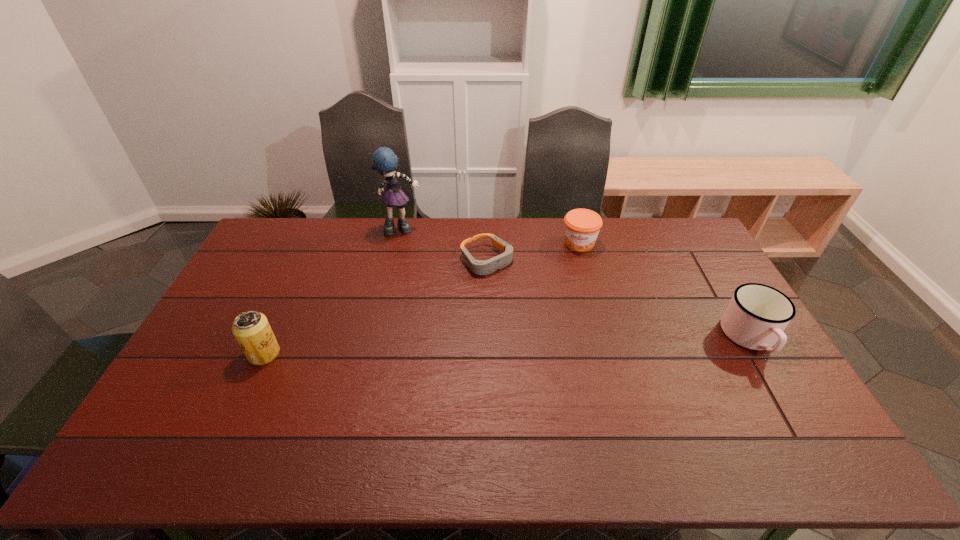
Where is `vacant space that's between the third object from left to right and the mug`? The height and width of the screenshot is (540, 960). vacant space that's between the third object from left to right and the mug is located at coordinates (618, 299).

You are a GUI agent. You are given a task and a screenshot of the screen. Output one action in this format:
    pyautogui.click(x=<x>, y=<y>)
    Task: Click on the free spot between the rightmost object and the goggles
    This screenshot has height=540, width=960.
    Given the screenshot: What is the action you would take?
    point(618,299)

Find the location of a particular element. The height and width of the screenshot is (540, 960). free space between the second shortest object and the mug is located at coordinates (665, 291).

You are a GUI agent. You are given a task and a screenshot of the screen. Output one action in this format:
    pyautogui.click(x=<x>, y=<y>)
    Task: Click on the empty space that is in between the beer can and the fourth object from right to left
    
    Given the screenshot: What is the action you would take?
    pyautogui.click(x=333, y=292)

Identify the location of free space that is in between the rightmost object and the fourth tallest object. The image size is (960, 540). (665, 291).

Find the location of a particular element. vacant area that lies between the beer can and the second shortest object is located at coordinates (421, 298).

I want to click on empty space between the beer can and the goggles, so click(x=375, y=307).

This screenshot has height=540, width=960. I want to click on empty location between the leftmost object and the second object from left to right, so click(x=333, y=292).

Where is `vacant area between the fourth object from left to right and the mug`? The image size is (960, 540). vacant area between the fourth object from left to right and the mug is located at coordinates (665, 291).

At what (x,y) coordinates should I click in order to perform the action: click on object that is the closest to the fourth object from right to left. Please return your answer as a coordinate pair (x, y). Looking at the image, I should click on [479, 267].